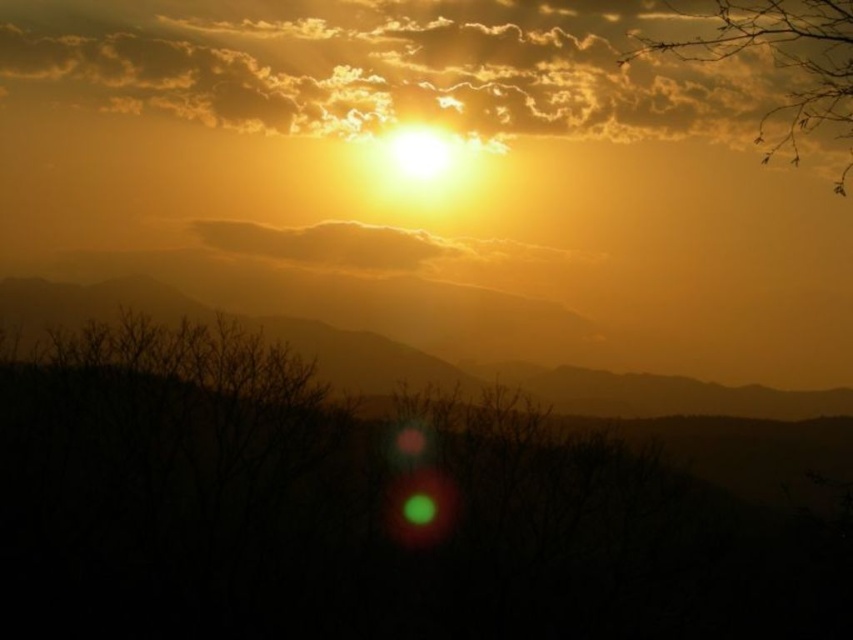
You are a photographer standing at the edge of a forest, wanting to capture both the silhouette bark tree at lower left and the silhouetted mountain at center in the same frame. Given that your camera has a 50mm lens which has a field of view that can capture objects up to 25 feet apart, will you be able to fit both objects into the frame without moving closer or farther away?

The silhouette bark tree at lower left and the silhouetted mountain at center are 26.14 feet apart from each other. Since the camera lens can only capture up to 25 feet between objects, the distance is slightly too large. You may need to adjust your position or use a different lens to include both in the frame.

You are standing in the sunset scene and want to take a photo of the silhouette bark tree at lower left. Where should you position yourself to capture the tree in the lower left corner of your camera frame?

Position yourself such that the silhouette bark tree at lower left is aligned with the lower left corner of your camera frame, as its 2D location is at point (360, 513).

You are an artist trying to paint the sunset scene. You need to decide the order of the objects in terms of height. Which object is taller, the silhouetted mountain at center or the silvery branches at upper right?

The silvery branches at upper right are taller than the silhouetted mountain at center according to the description.